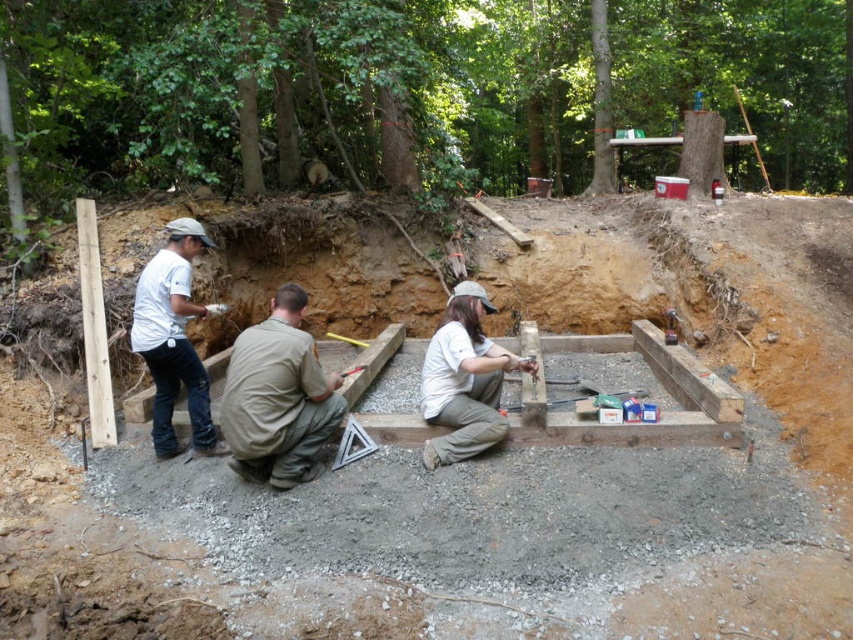
You are a drone operator trying to deliver a tool to the construction workers. The coordinates of the delivery point are set to the location of the brown uniform at center. What are the coordinates where you should drop the tool?

The coordinates for the brown uniform at center are at point (277, 397), so you should drop the tool there.

In the scene shown: What is the 2D coordinate of the brown uniform at center?

The 2D coordinate of the brown uniform at center is point [277,397].